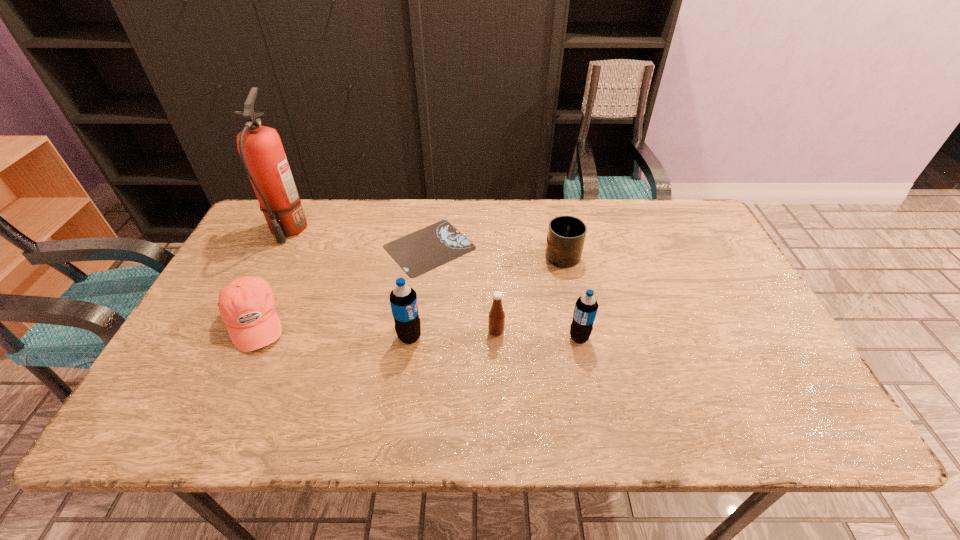
Where is `vacant space located on the back of the left soda bottle`? This screenshot has width=960, height=540. vacant space located on the back of the left soda bottle is located at coordinates (417, 287).

The width and height of the screenshot is (960, 540). I want to click on free space located 0.170m on the back of the shorter soda bottle, so click(x=568, y=282).

The width and height of the screenshot is (960, 540). What are the coordinates of `vacant region located on the nozzle of the tallest object` in the screenshot? It's located at (228, 350).

Where is `free location located 0.310m on the back of the baseball cap`? free location located 0.310m on the back of the baseball cap is located at coordinates (300, 224).

At what (x,y) coordinates should I click in order to perform the action: click on vacant space located 0.060m with the handle on the side of the mug. Please return your answer as a coordinate pair (x, y). The image size is (960, 540). Looking at the image, I should click on (557, 227).

Where is `vacant space located with the handle on the side of the mug`? vacant space located with the handle on the side of the mug is located at coordinates (556, 224).

Where is `free spot located 0.210m on the front of the shortest object`? This screenshot has width=960, height=540. free spot located 0.210m on the front of the shortest object is located at coordinates (418, 338).

Where is `vacant space situated 0.290m on the back of the Tabasco sauce`? vacant space situated 0.290m on the back of the Tabasco sauce is located at coordinates (493, 251).

Where is `fire extinguisher situated at the far edge`? The width and height of the screenshot is (960, 540). fire extinguisher situated at the far edge is located at coordinates (260, 147).

Where is `mug at the far edge`? This screenshot has height=540, width=960. mug at the far edge is located at coordinates (566, 235).